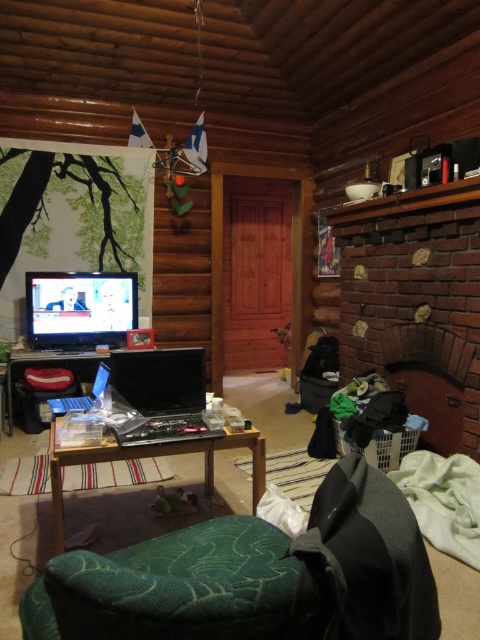
You are standing in the living room and want to place a new painting on the wall near the brick fireplace at upper right. Based on its position, where should you look to place the painting?

The brick fireplace at upper right is located at point [416,301], so you should place the painting near those coordinates on the wall.

You are sitting on the green fabric armchair at lower center and want to reach the brick fireplace at upper right. Which direction should you move to get closer to the fireplace?

The green fabric armchair at lower center is in front of the brick fireplace at upper right, so you should move backward to get closer to the fireplace.